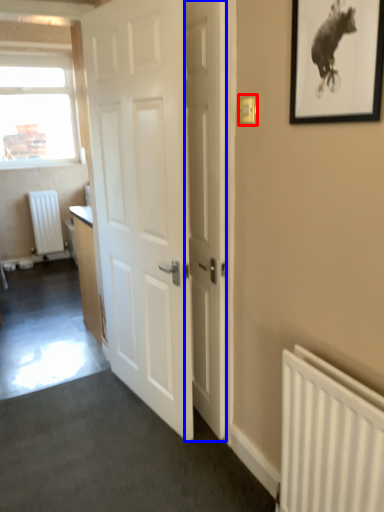
Question: Which object is closer to the camera taking this photo, light switch (highlighted by a red box) or door (highlighted by a blue box)?

Choices:
 (A) light switch
 (B) door

Answer: (A)